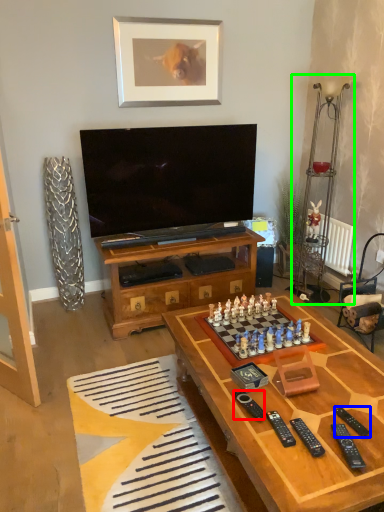
Question: Estimate the real-world distances between objects in this image. Which object is closer to remote (highlighted by a red box), remote (highlighted by a blue box) or lamp (highlighted by a green box)?

Choices:
 (A) remote
 (B) lamp

Answer: (A)